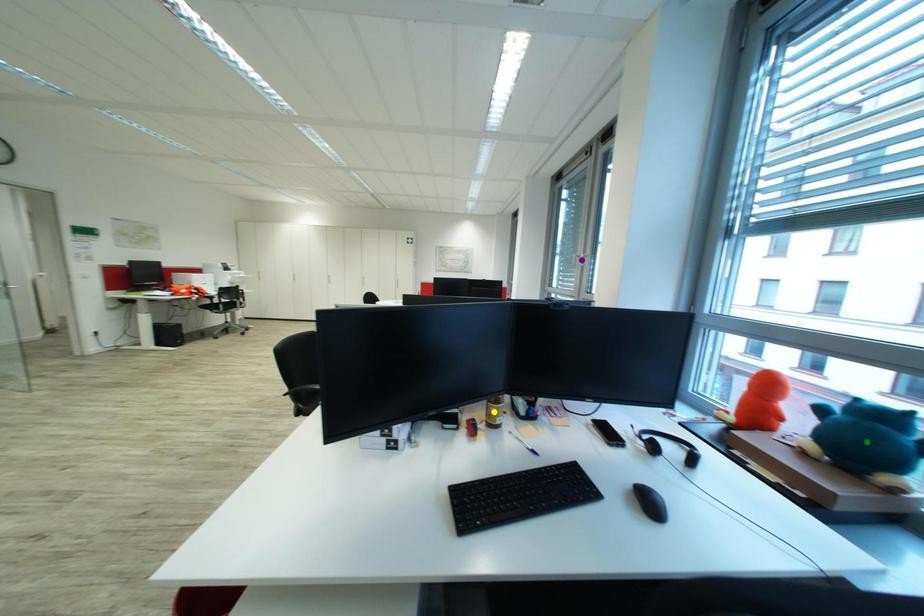
Order these from nearest to farthest:
- green point
- purple point
- yellow point

1. purple point
2. yellow point
3. green point